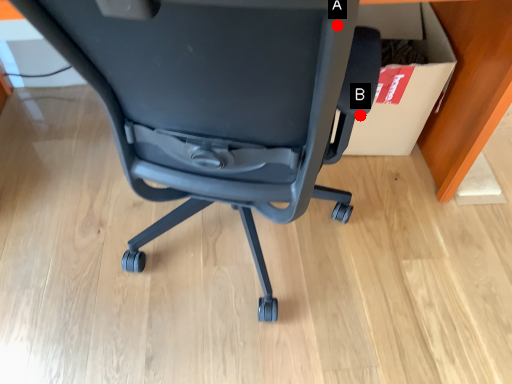
Question: Two points are circled on the image, labeled by A and B beside each circle. Which of the following is the closest to the observer?

Choices:
 (A) A is closer
 (B) B is closer

Answer: (A)